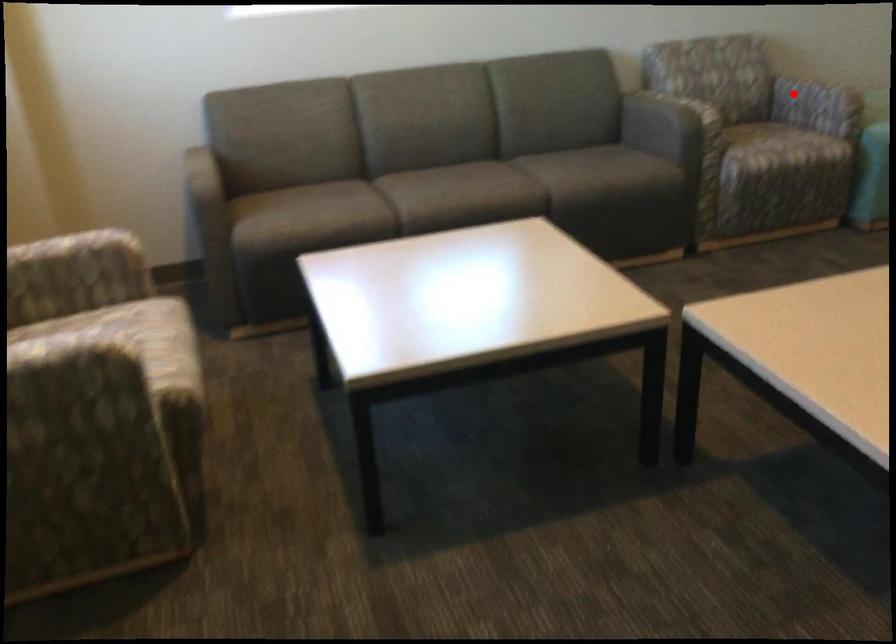
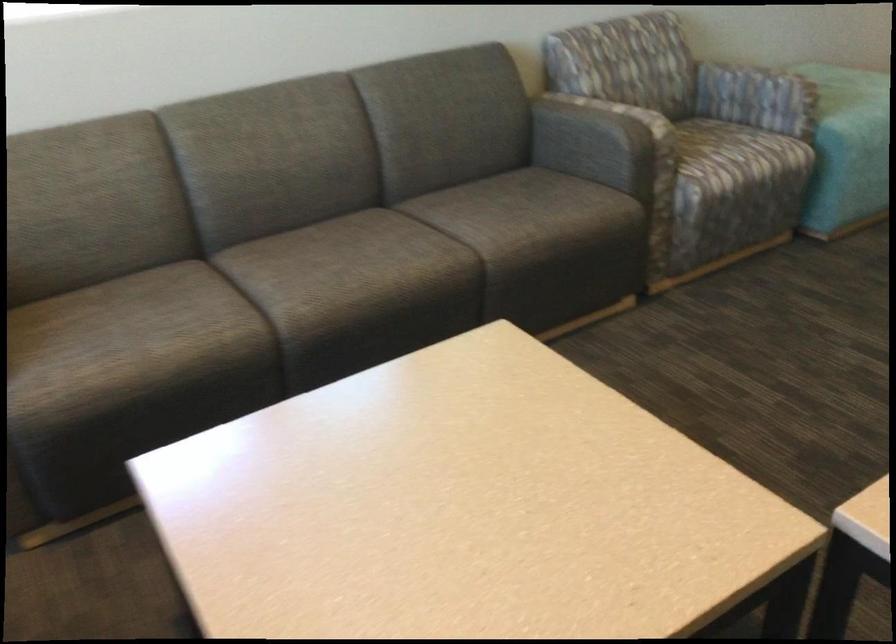
Question: I am providing you with two images of the same scene from different viewpoints. A red point is shown in image1. For the corresponding object point in image2, is it positioned nearer or farther from the camera?

Choices:
 (A) Nearer
 (B) Farther

Answer: (A)